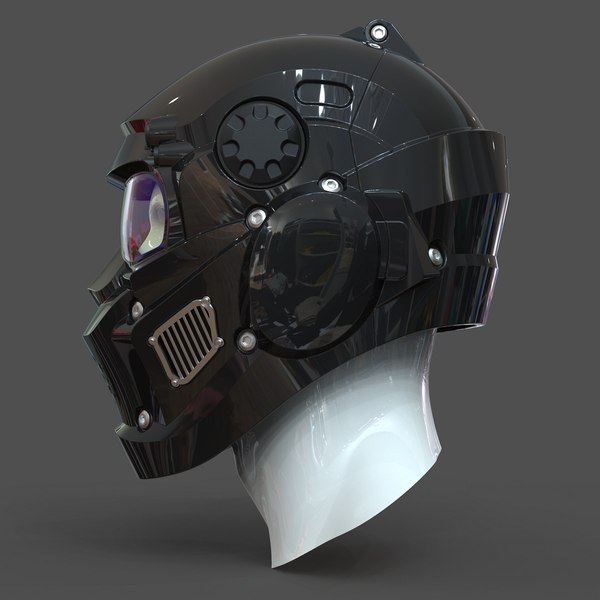
Find the location of `vent`. vent is located at coordinates (190, 335).